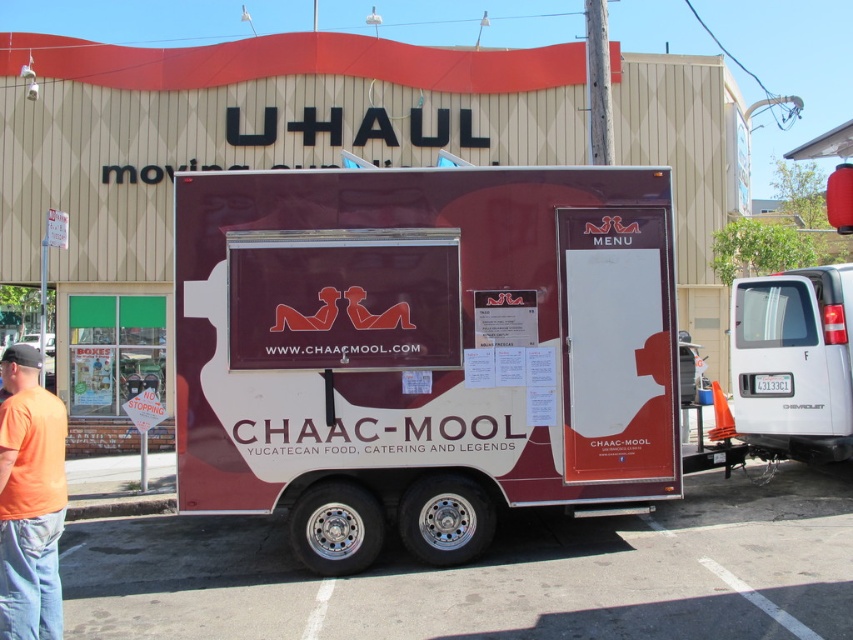
You are standing in front of the food truck and want to take a photo of the two points on the truck. Which point, point (616, 282) or point (4, 429), will appear closer to the camera in the photo?

Point (616, 282) is further to the camera than point (4, 429), so point (4, 429) will appear closer to the camera in the photo.